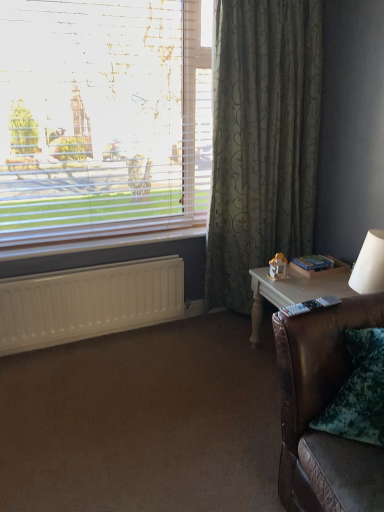
Question: From their relative heights in the image, would you say white matte radiator at lower left is taller or shorter than white blinds at upper left?

Choices:
 (A) tall
 (B) short

Answer: (B)

Question: Is point (16, 279) positioned closer to the camera than point (208, 138)?

Choices:
 (A) farther
 (B) closer

Answer: (B)

Question: Estimate the real-world distances between objects in this image. Which object is closer to the white wood table at right?

Choices:
 (A) white blinds at upper left
 (B) brown leather couch at lower right
 (C) white matte radiator at lower left
 (D) white plastic radiator at lower left
 (E) brown leather couch at lower right

Answer: (E)

Question: Which of these objects is positioned farthest from the brown leather couch at lower right?

Choices:
 (A) green textured curtain at right
 (B) brown leather couch at lower right
 (C) white plastic radiator at lower left
 (D) white wood table at right
 (E) white blinds at upper left

Answer: (E)